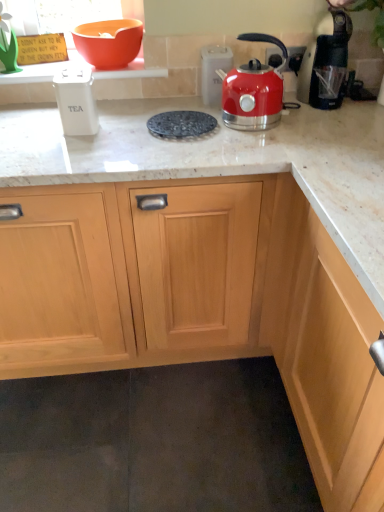
Find the location of `vacant position to the left of metallic silver kettle at upper right, acting as the third kitchen appliance starting from the right`. vacant position to the left of metallic silver kettle at upper right, acting as the third kitchen appliance starting from the right is located at coordinates (174, 104).